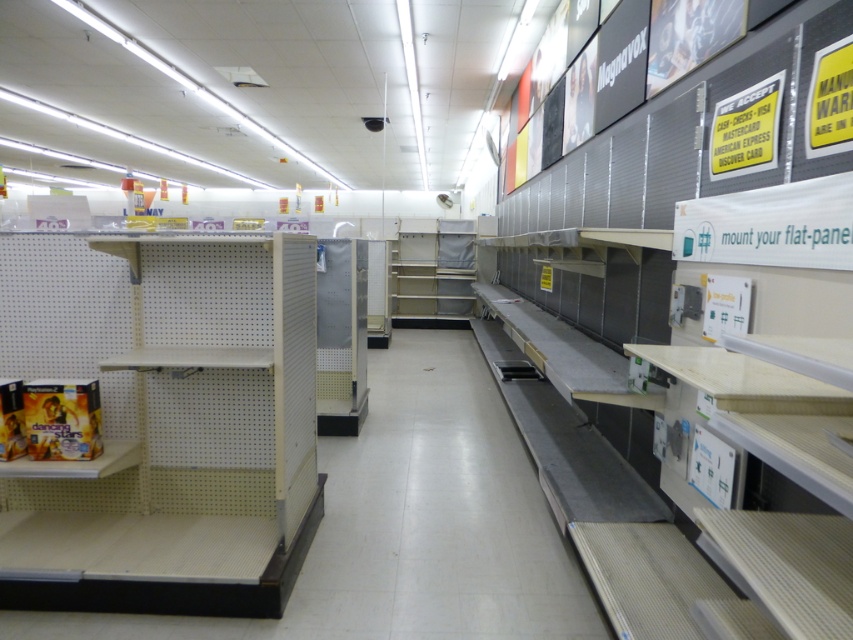
Question: Does white matte shelf at left have a larger size compared to metallic silver shelf at center?

Choices:
 (A) no
 (B) yes

Answer: (A)

Question: Does white pegboard shelf at left appear over white matte shelf at left?

Choices:
 (A) yes
 (B) no

Answer: (A)

Question: Which object is positioned farthest from the metallic silver shelf at center?

Choices:
 (A) white matte shelf at left
 (B) white pegboard shelf at left

Answer: (A)

Question: Does white matte shelf at left have a greater width compared to metallic silver shelf at center?

Choices:
 (A) no
 (B) yes

Answer: (A)

Question: Which of the following is the closest to the observer?

Choices:
 (A) metallic silver shelf at center
 (B) white pegboard shelf at left
 (C) white matte shelf at left

Answer: (B)

Question: Which object appears closest to the camera in this image?

Choices:
 (A) white pegboard shelf at left
 (B) metallic silver shelf at center

Answer: (A)